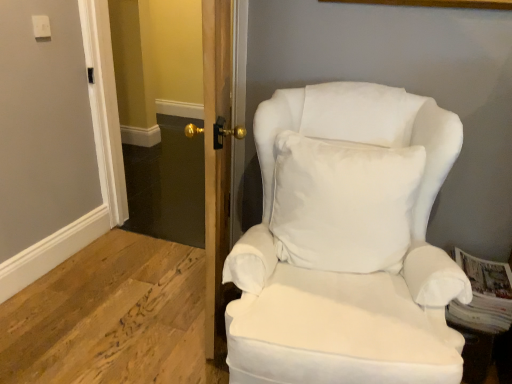
This screenshot has height=384, width=512. In order to click on vacant region to the left of wooden door at center in this screenshot , I will do (132, 294).